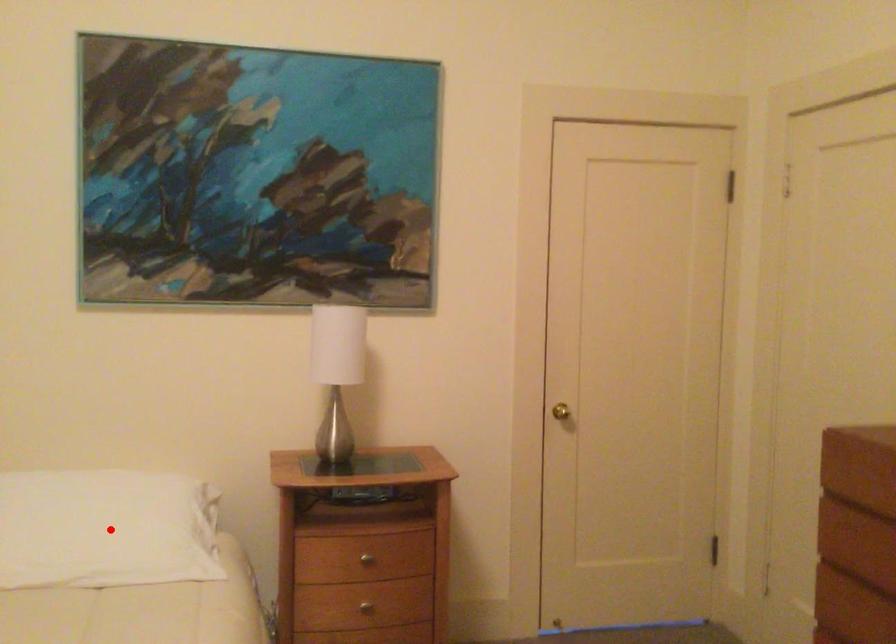
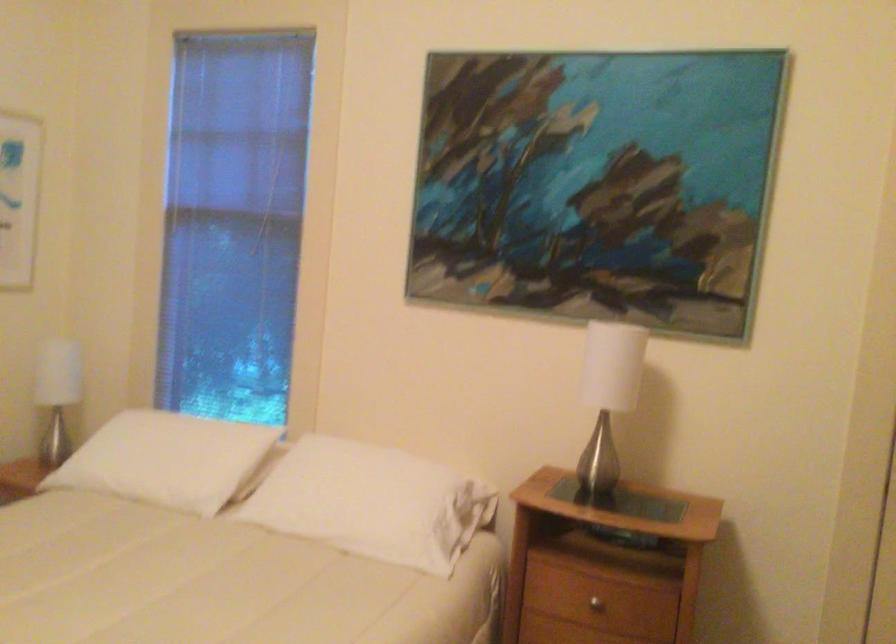
In the second image, find the point that corresponds to the highlighted location in the first image.

(373, 502)